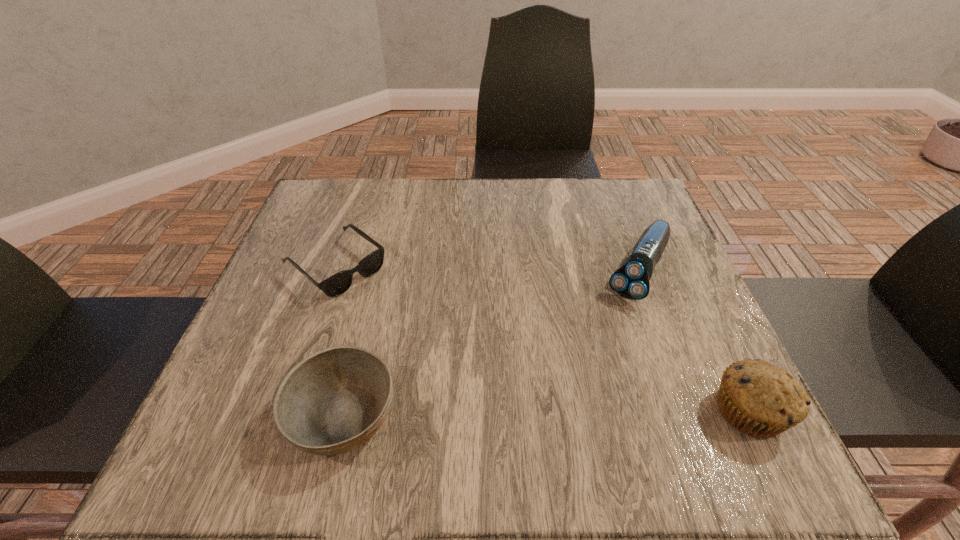
In order to click on empty location between the shortest object and the electric shaver in this screenshot , I will do `click(487, 268)`.

At what (x,y) coordinates should I click in order to perform the action: click on vacant space that's between the electric shaver and the sunglasses. Please return your answer as a coordinate pair (x, y). This screenshot has height=540, width=960. Looking at the image, I should click on (487, 268).

Where is `empty location between the sunglasses and the bowl`? empty location between the sunglasses and the bowl is located at coordinates (340, 340).

Where is `vacant space that is in between the muffin and the sunglasses`? The width and height of the screenshot is (960, 540). vacant space that is in between the muffin and the sunglasses is located at coordinates (542, 339).

You are a GUI agent. You are given a task and a screenshot of the screen. Output one action in this format:
    pyautogui.click(x=<x>, y=<y>)
    Task: Click on the blank region between the sunglasses and the muffin
    The height and width of the screenshot is (540, 960).
    Given the screenshot: What is the action you would take?
    pyautogui.click(x=542, y=339)

This screenshot has width=960, height=540. I want to click on free space between the sunglasses and the electric shaver, so click(487, 268).

Locate an element on the screen. The width and height of the screenshot is (960, 540). vacant space that is in between the third tallest object and the electric shaver is located at coordinates (491, 343).

Find the location of a particular element. The height and width of the screenshot is (540, 960). object that ranks as the third closest to the electric shaver is located at coordinates (337, 284).

Image resolution: width=960 pixels, height=540 pixels. I want to click on object that is the third closest to the electric shaver, so click(337, 284).

At what (x,y) coordinates should I click in order to perform the action: click on free point that satisfies the following two spatial constraints: 1. on the front side of the muffin; 2. on the left side of the sunglasses. Please return your answer as a coordinate pair (x, y). This screenshot has height=540, width=960. Looking at the image, I should click on (285, 411).